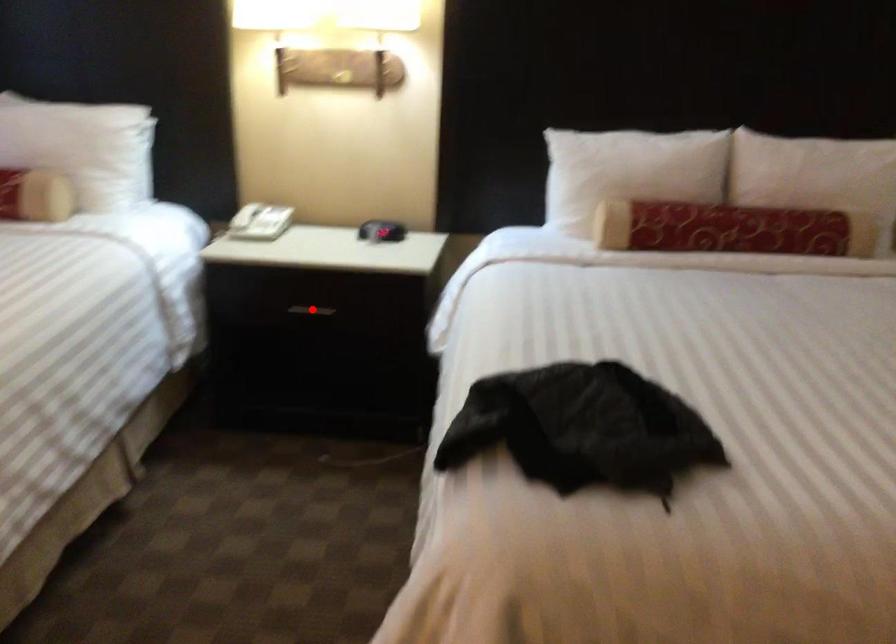
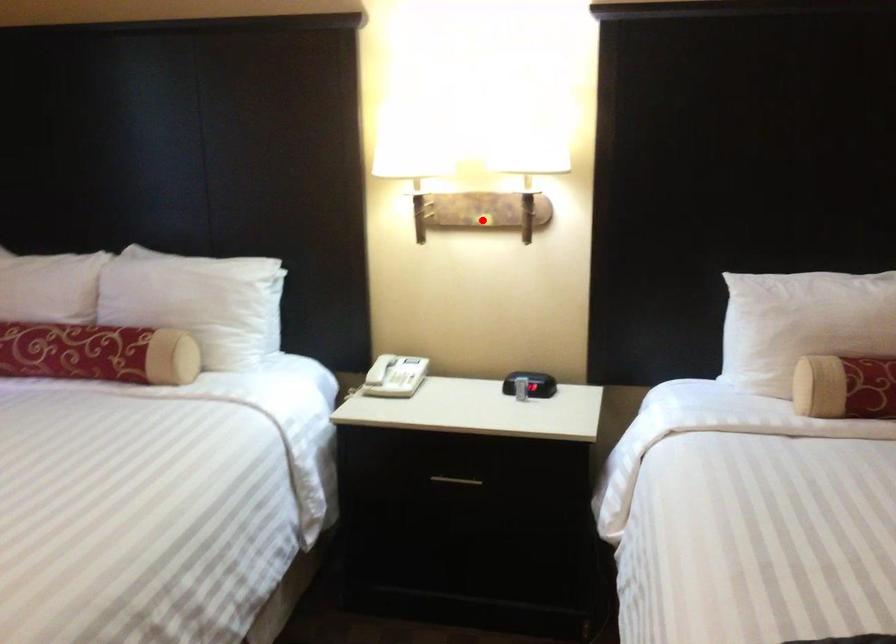
I am providing you with two images of the same scene from different viewpoints. A red point is marked on the first image and another point is marked on the second image. Do the highlighted points in image1 and image2 indicate the same real-world spot?

No